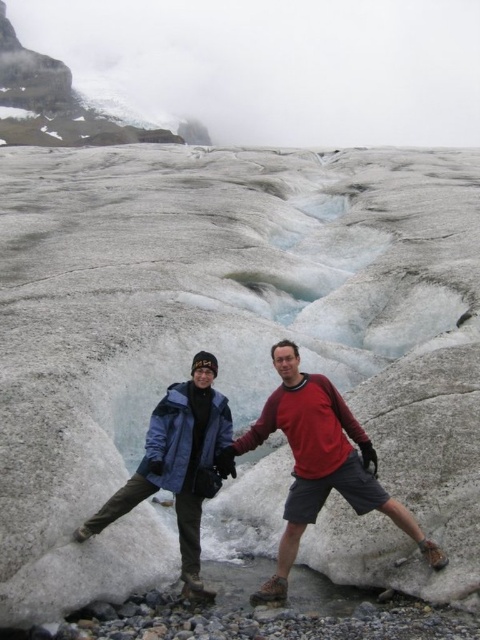
Question: Which point is farther from the camera taking this photo?

Choices:
 (A) (199, 426)
 (B) (220, 470)

Answer: (A)

Question: Can you confirm if matte red shirt at center is positioned below blue jacket at center?

Choices:
 (A) yes
 (B) no

Answer: (B)

Question: Is matte red shirt at center below blue jacket at center?

Choices:
 (A) no
 (B) yes

Answer: (A)

Question: Is matte red shirt at center thinner than blue jacket at center?

Choices:
 (A) yes
 (B) no

Answer: (B)